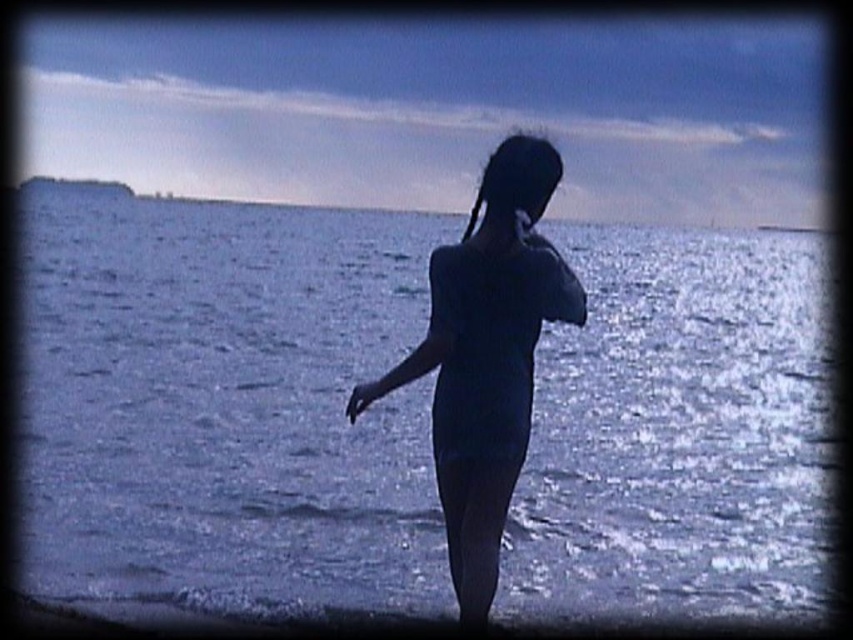
Which is behind, point (74, 452) or point (515, 332)?

Point (74, 452)

Between point (589, 372) and point (392, 380), which one is positioned in front?

Point (392, 380) is more forward.

Where is `blue water at center`? blue water at center is located at coordinates (225, 404).